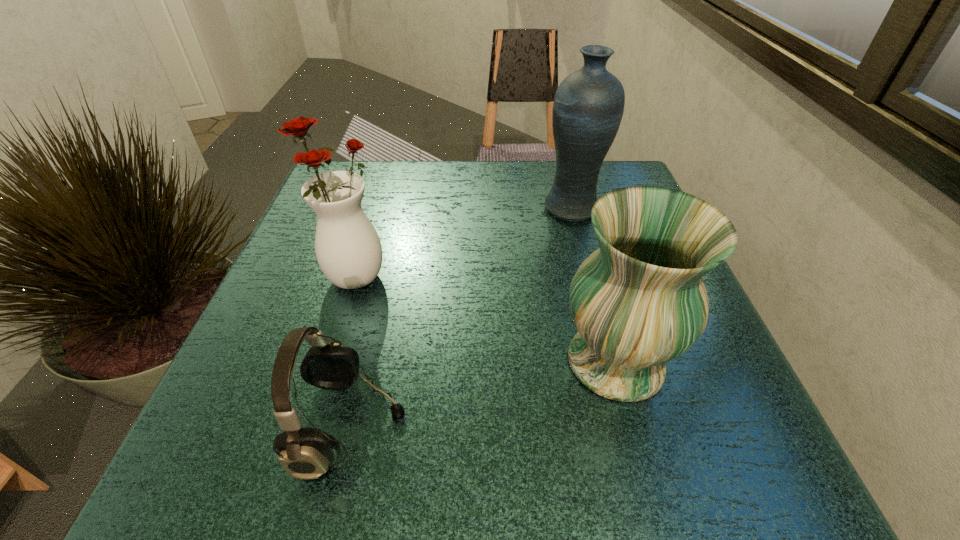
The image size is (960, 540). In the image, there is a desktop. What are the coordinates of `free space at the near right corner` in the screenshot? It's located at (685, 435).

At what (x,y) coordinates should I click in order to perform the action: click on free spot between the farthest vase and the headset. Please return your answer as a coordinate pair (x, y). Image resolution: width=960 pixels, height=540 pixels. Looking at the image, I should click on (462, 317).

What are the coordinates of `free space between the nearest vase and the second nearest vase` in the screenshot? It's located at (485, 319).

Where is `free space between the nearest vase and the leftmost vase`? Image resolution: width=960 pixels, height=540 pixels. free space between the nearest vase and the leftmost vase is located at coordinates (485, 319).

Locate an element on the screen. free point between the shortest object and the farthest vase is located at coordinates (462, 317).

The image size is (960, 540). What are the coordinates of `unoccupied area between the leftmost vase and the nearest vase` in the screenshot? It's located at (485, 319).

Identify the location of free space between the shortest object and the nearest vase. The height and width of the screenshot is (540, 960). (484, 394).

Find the location of a particular element. free space between the nearest vase and the second nearest vase is located at coordinates (485, 319).

This screenshot has height=540, width=960. What are the coordinates of `object that is the nearest to the second nearest vase` in the screenshot? It's located at (305, 453).

Choose which object is the nearest neighbor to the shortest object. Please provide its 2D coordinates. Your answer should be formatted as a tuple, i.e. [(x, y)], where the tuple contains the x and y coordinates of a point satisfying the conditions above.

[(348, 249)]